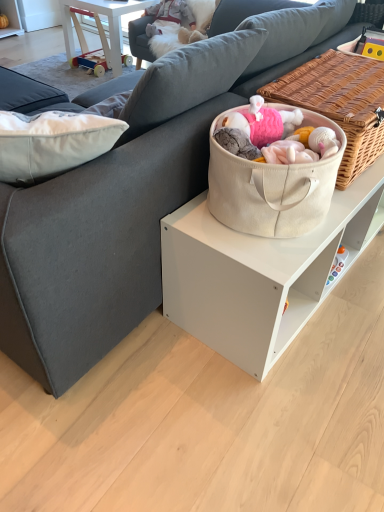
Question: Is wooden toy at upper left beside beige canvas tote at center?

Choices:
 (A) yes
 (B) no

Answer: (B)

Question: From a real-world perspective, is wooden toy at upper left under beige canvas tote at center?

Choices:
 (A) no
 (B) yes

Answer: (B)

Question: Is there a large distance between wooden toy at upper left and beige canvas tote at center?

Choices:
 (A) no
 (B) yes

Answer: (B)

Question: Is the depth of wooden toy at upper left less than that of beige canvas tote at center?

Choices:
 (A) no
 (B) yes

Answer: (A)

Question: Is beige canvas tote at center at the back of wooden toy at upper left?

Choices:
 (A) no
 (B) yes

Answer: (A)

Question: Considering the relative sizes of wooden toy at upper left and beige canvas tote at center in the image provided, is wooden toy at upper left smaller than beige canvas tote at center?

Choices:
 (A) no
 (B) yes

Answer: (A)

Question: Is beige canvas tote at center turned away from wooden toy at upper left?

Choices:
 (A) yes
 (B) no

Answer: (A)

Question: Is beige canvas tote at center positioned before wooden toy at upper left?

Choices:
 (A) yes
 (B) no

Answer: (A)

Question: Is beige canvas tote at center touching wooden toy at upper left?

Choices:
 (A) no
 (B) yes

Answer: (A)

Question: From a real-world perspective, is beige canvas tote at center under wooden toy at upper left?

Choices:
 (A) no
 (B) yes

Answer: (A)

Question: Does beige canvas tote at center come behind wooden toy at upper left?

Choices:
 (A) no
 (B) yes

Answer: (A)

Question: Is beige canvas tote at center wider than wooden toy at upper left?

Choices:
 (A) no
 (B) yes

Answer: (A)

Question: Is beige canvas tote at center wider or thinner than wooden toy at upper left?

Choices:
 (A) thin
 (B) wide

Answer: (A)